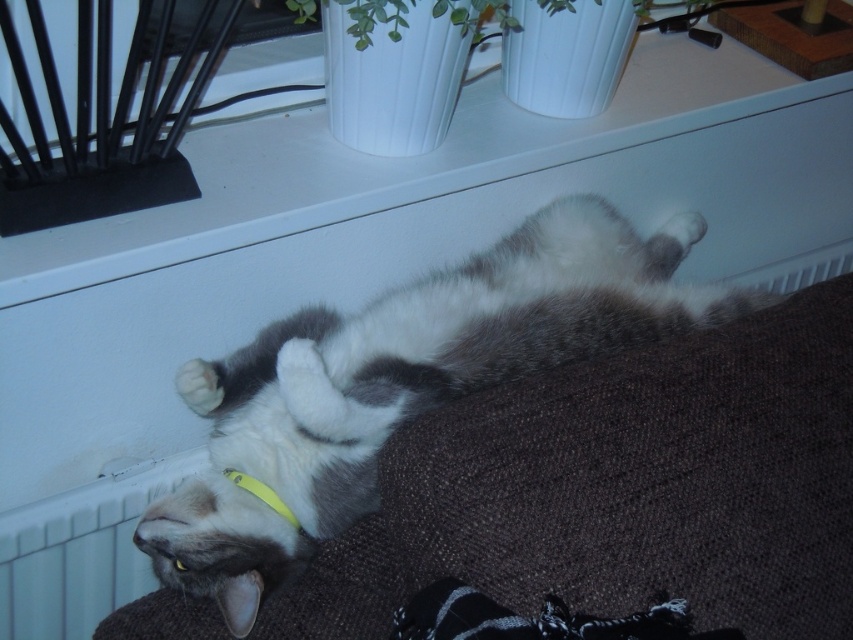
Is point (277, 376) positioned before point (289, 522)?

Yes, it is in front of point (289, 522).

Is gray fur cat at center above yellow fabric neckband at lower center?

Yes.

Describe the element at coordinates (402, 385) in the screenshot. The height and width of the screenshot is (640, 853). I see `gray fur cat at center` at that location.

This screenshot has width=853, height=640. I want to click on gray fur cat at center, so click(x=402, y=385).